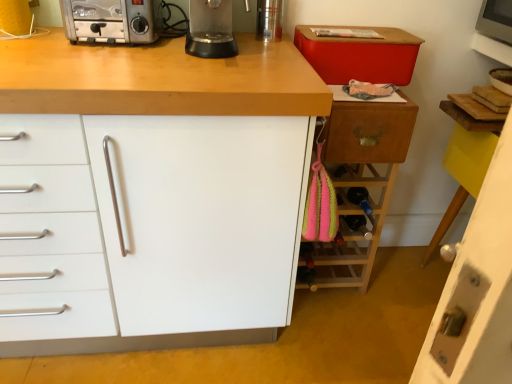
The height and width of the screenshot is (384, 512). In order to click on free location in front of transparent plastic blender at center in this screenshot , I will do `click(225, 62)`.